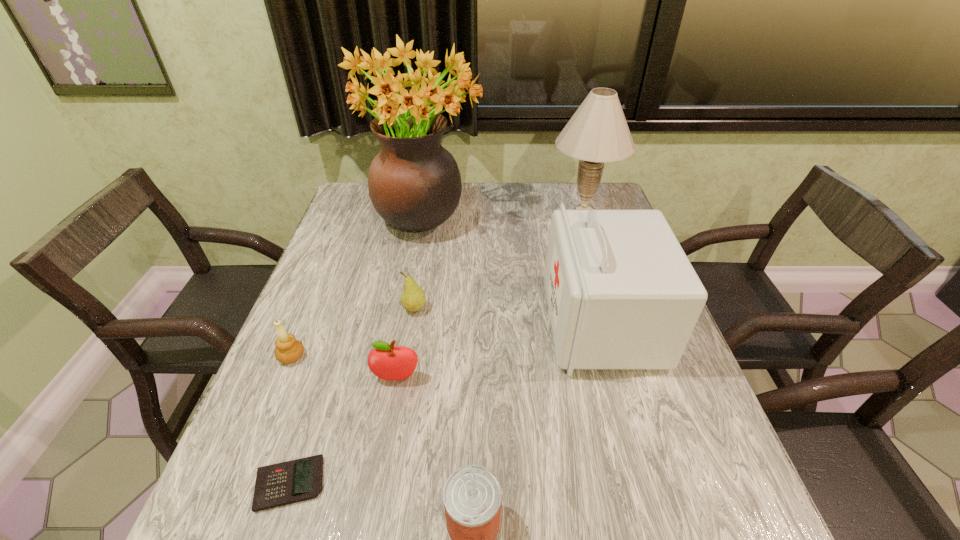
Locate an element on the screen. The image size is (960, 540). flower arrangement is located at coordinates (414, 183).

This screenshot has height=540, width=960. I want to click on lampshade, so click(x=598, y=132).

Locate an element on the screen. the sixth shortest object is located at coordinates (622, 295).

Identify the location of pear. (413, 299).

Locate an element on the screen. The width and height of the screenshot is (960, 540). apple is located at coordinates (387, 362).

Locate an element on the screen. candle_holder is located at coordinates (288, 350).

You are a GUI agent. You are given a task and a screenshot of the screen. Output one action in this format:
    pyautogui.click(x=<x>, y=<y>)
    Task: Click on the shortest object
    This screenshot has width=960, height=540.
    Given the screenshot: What is the action you would take?
    pos(280,484)

At what (x,y) coordinates should I click in order to perform the action: click on free space located on the right of the tallest object. Please return your answer as a coordinate pair (x, y). Image resolution: width=960 pixels, height=540 pixels. Looking at the image, I should click on (555, 216).

Locate an element on the screen. The height and width of the screenshot is (540, 960). vacant space located on the left of the lampshade is located at coordinates (441, 209).

This screenshot has width=960, height=540. Find the location of `vacant space located 0.110m on the front-facing side of the first-aid kit`. vacant space located 0.110m on the front-facing side of the first-aid kit is located at coordinates (503, 323).